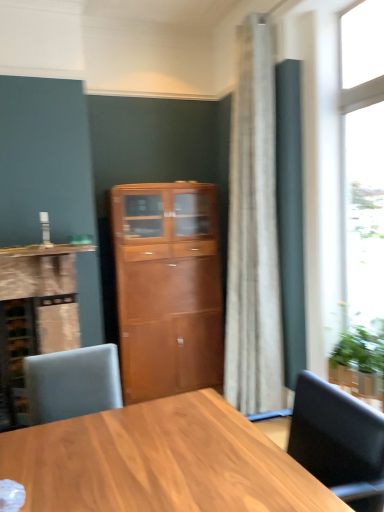
Question: Should I look upward or downward to see white marble countertop at left?

Choices:
 (A) up
 (B) down

Answer: (A)

Question: Is matte wood cabinet at left a part of transparent glass window at right?

Choices:
 (A) no
 (B) yes

Answer: (A)

Question: From the image's perspective, is transparent glass window at right beneath matte wood cabinet at left?

Choices:
 (A) yes
 (B) no

Answer: (B)

Question: Is transparent glass window at right positioned with its back to matte wood cabinet at left?

Choices:
 (A) yes
 (B) no

Answer: (B)

Question: From the image's perspective, is transparent glass window at right over matte wood cabinet at left?

Choices:
 (A) no
 (B) yes

Answer: (B)

Question: Is there a large distance between transparent glass window at right and matte wood cabinet at left?

Choices:
 (A) yes
 (B) no

Answer: (A)

Question: Is transparent glass window at right facing towards matte wood cabinet at left?

Choices:
 (A) no
 (B) yes

Answer: (A)

Question: Is transparent glass window at right not near white marble countertop at left?

Choices:
 (A) yes
 (B) no

Answer: (A)

Question: Does transparent glass window at right have a larger size compared to white marble countertop at left?

Choices:
 (A) no
 (B) yes

Answer: (B)

Question: From a real-world perspective, is transparent glass window at right positioned under white marble countertop at left based on gravity?

Choices:
 (A) no
 (B) yes

Answer: (A)

Question: Is white marble countertop at left completely or partially inside transparent glass window at right?

Choices:
 (A) no
 (B) yes

Answer: (A)

Question: Is the depth of transparent glass window at right greater than that of white marble countertop at left?

Choices:
 (A) yes
 (B) no

Answer: (B)

Question: Is transparent glass window at right aimed at white marble countertop at left?

Choices:
 (A) yes
 (B) no

Answer: (B)

Question: Is matte wood cabinet at left looking in the opposite direction of transparent glass window at right?

Choices:
 (A) no
 (B) yes

Answer: (A)